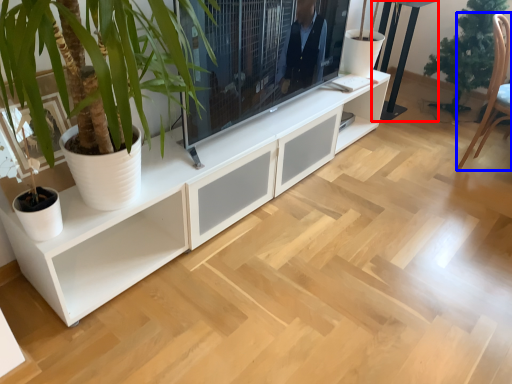
Question: Which point is further to the camera, table (highlighted by a red box) or armchair (highlighted by a blue box)?

Choices:
 (A) table
 (B) armchair

Answer: (A)